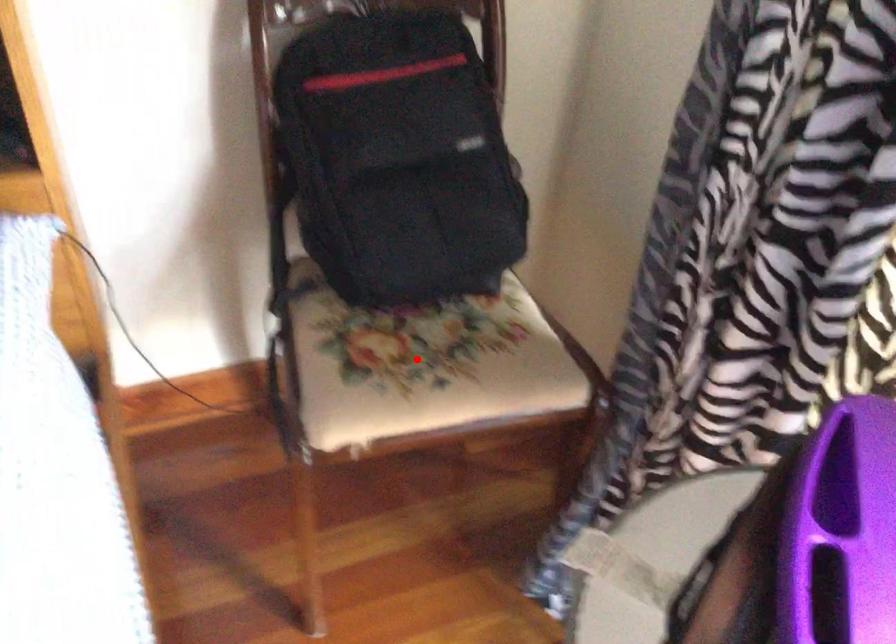
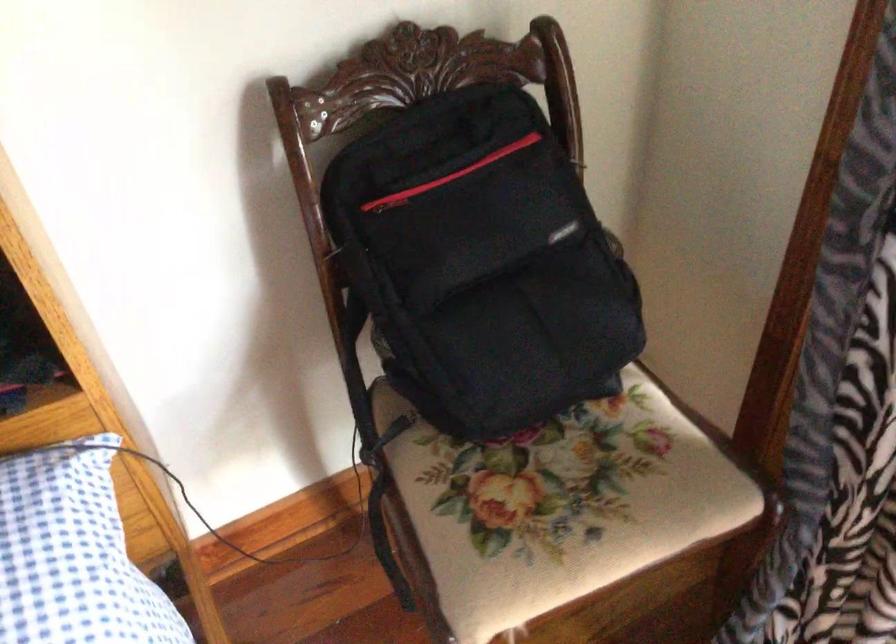
The point at the highlighted location is marked in the first image. Where is the corresponding point in the second image?

(556, 506)